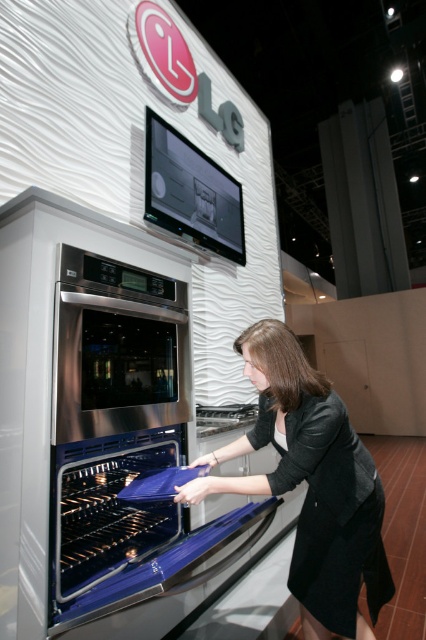
You are at a trade show and want to take a photo of the stainless steel oven at center and the black fabric dress at lower center. Which object should you focus on first to ensure both are in frame without moving the camera?

The stainless steel oven at center is positioned on the left side of black fabric dress at lower center, so you should focus on the black fabric dress at lower center first to ensure both are in frame without moving the camera.